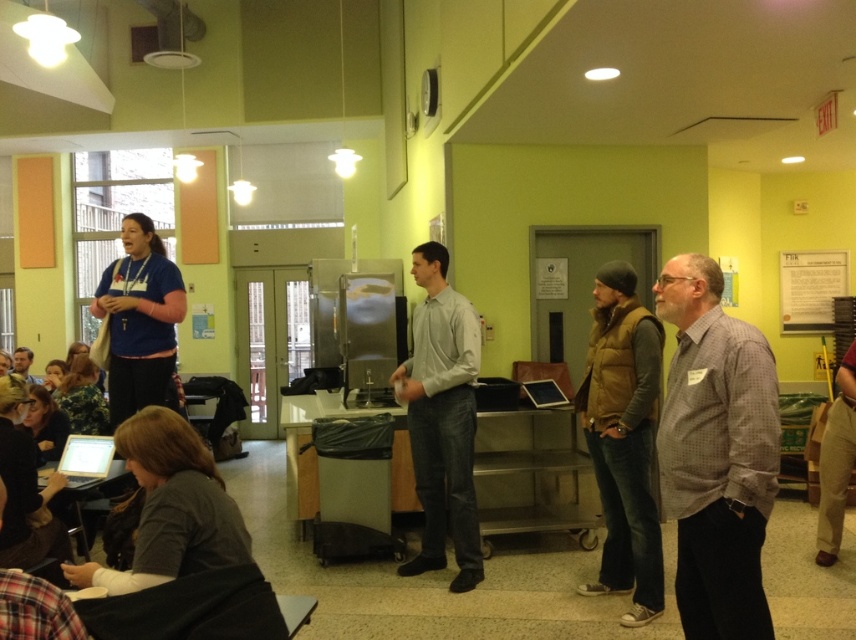
You are a photographer standing at the camera position. You want to take a closeup photo of the gray checkered shirt at center. The minimum focusing distance of your camera is 2 meters. Is it possible to take the photo without moving the subject?

The distance between the gray checkered shirt at center and the camera is 2.57 meters, which is greater than the minimum focusing distance of 2 meters. Therefore, it is possible to take the closeup photo without moving the subject.

You are a photographer trying to capture a closeup of the speaker without including the audience. You notice two items at center, the brown suede vest at center and the light gray shirt at center. Which one should you focus on to ensure it fits within your camera frame?

The brown suede vest at center has a smaller size compared to light gray shirt at center, so focusing on the brown suede vest at center would ensure it fits within the camera frame better.

You are sitting at the back of the room and want to see the gray checkered shirt at center clearly. Which direction should you look relative to the podium?

The gray checkered shirt at center is located at point (x=716, y=452), so you should look towards the center area of the room relative to the podium.